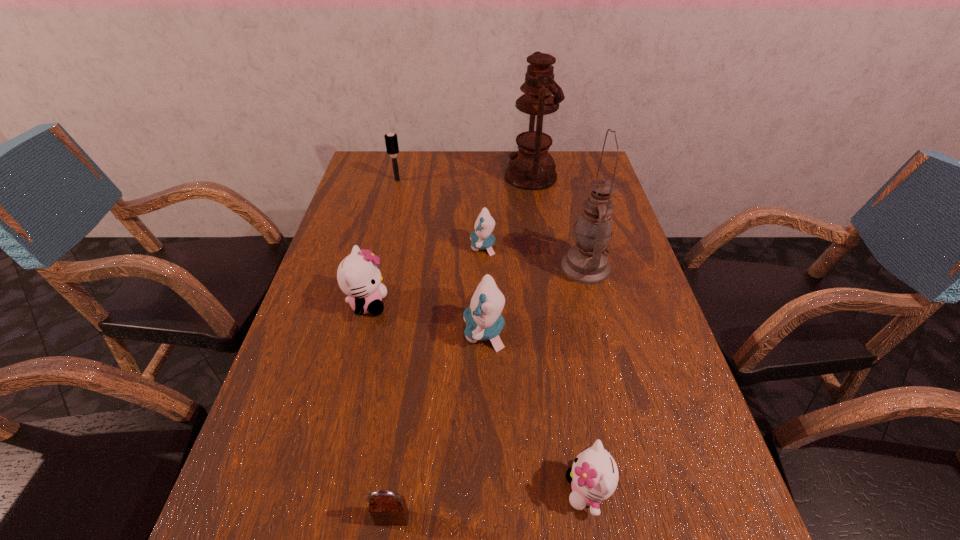
Locate an element on the screen. Image resolution: width=960 pixels, height=540 pixels. padlock is located at coordinates (387, 508).

Where is `brown padlock`? The width and height of the screenshot is (960, 540). brown padlock is located at coordinates (387, 508).

This screenshot has height=540, width=960. Find the location of `vacant area situated 0.280m on the left of the farther oil lamp`. vacant area situated 0.280m on the left of the farther oil lamp is located at coordinates (423, 176).

This screenshot has height=540, width=960. What are the coordinates of `vacant space located 0.300m on the back of the gray oil lamp` in the screenshot? It's located at (565, 189).

Locate an element on the screen. This screenshot has height=540, width=960. free space located 0.300m on the front of the hairbrush is located at coordinates (382, 240).

The image size is (960, 540). Find the location of `vacant region located on the face of the nearer blue kitten`. vacant region located on the face of the nearer blue kitten is located at coordinates (329, 332).

The width and height of the screenshot is (960, 540). In order to click on free space located on the face of the nearer blue kitten in this screenshot , I will do `click(316, 332)`.

You are a GUI agent. You are given a task and a screenshot of the screen. Output one action in this format:
    pyautogui.click(x=<x>, y=<y>)
    Task: Click on the vacant region located on the face of the nearer blue kitten
    This screenshot has height=540, width=960.
    Given the screenshot: What is the action you would take?
    pyautogui.click(x=381, y=332)

You are a GUI agent. You are given a task and a screenshot of the screen. Output one action in this format:
    pyautogui.click(x=<x>, y=<y>)
    Task: Click on the free space located 0.100m on the front-facing side of the left white kitten
    This screenshot has width=960, height=540.
    Given the screenshot: What is the action you would take?
    pyautogui.click(x=428, y=304)

Image resolution: width=960 pixels, height=540 pixels. Identify the location of vacant region located on the front-facing side of the smaller white kitten. (364, 490).